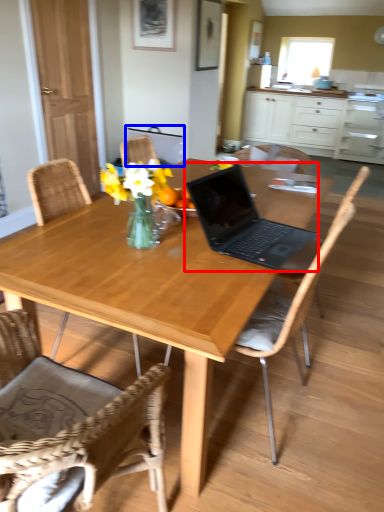
Question: Which of the following is the farthest to the observer, laptop (highlighted by a red box) or armchair (highlighted by a blue box)?

Choices:
 (A) laptop
 (B) armchair

Answer: (B)